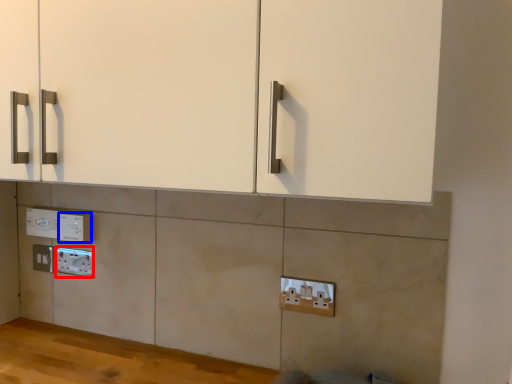
Question: Among these objects, which one is farthest to the camera, electric outlet (highlighted by a red box) or electric outlet (highlighted by a blue box)?

Choices:
 (A) electric outlet
 (B) electric outlet

Answer: (A)